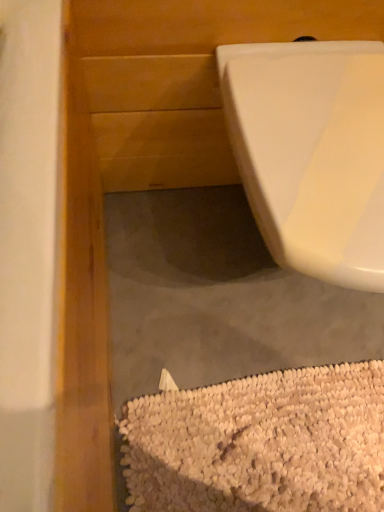
Question: Is white glossy toilet at upper right wider than white textured rug at lower right?

Choices:
 (A) no
 (B) yes

Answer: (B)

Question: Is white glossy toilet at upper right thinner than white textured rug at lower right?

Choices:
 (A) yes
 (B) no

Answer: (B)

Question: Does white glossy toilet at upper right contain white textured rug at lower right?

Choices:
 (A) no
 (B) yes

Answer: (A)

Question: Is the depth of white glossy toilet at upper right less than that of white textured rug at lower right?

Choices:
 (A) yes
 (B) no

Answer: (A)

Question: Considering the relative sizes of white glossy toilet at upper right and white textured rug at lower right in the image provided, is white glossy toilet at upper right smaller than white textured rug at lower right?

Choices:
 (A) yes
 (B) no

Answer: (B)

Question: Is white glossy toilet at upper right outside white textured rug at lower right?

Choices:
 (A) yes
 (B) no

Answer: (A)

Question: Is white textured rug at lower right positioned behind white glossy toilet at upper right?

Choices:
 (A) no
 (B) yes

Answer: (B)

Question: Can you confirm if white textured rug at lower right is shorter than white glossy toilet at upper right?

Choices:
 (A) no
 (B) yes

Answer: (B)

Question: Is white glossy toilet at upper right a part of white textured rug at lower right?

Choices:
 (A) yes
 (B) no

Answer: (B)

Question: Is white textured rug at lower right thinner than white glossy toilet at upper right?

Choices:
 (A) no
 (B) yes

Answer: (B)

Question: From the image's perspective, is white textured rug at lower right on top of white glossy toilet at upper right?

Choices:
 (A) yes
 (B) no

Answer: (B)

Question: Is white textured rug at lower right outside white glossy toilet at upper right?

Choices:
 (A) no
 (B) yes

Answer: (B)

Question: Considering the positions of white glossy toilet at upper right and white textured rug at lower right in the image, is white glossy toilet at upper right wider or thinner than white textured rug at lower right?

Choices:
 (A) thin
 (B) wide

Answer: (B)